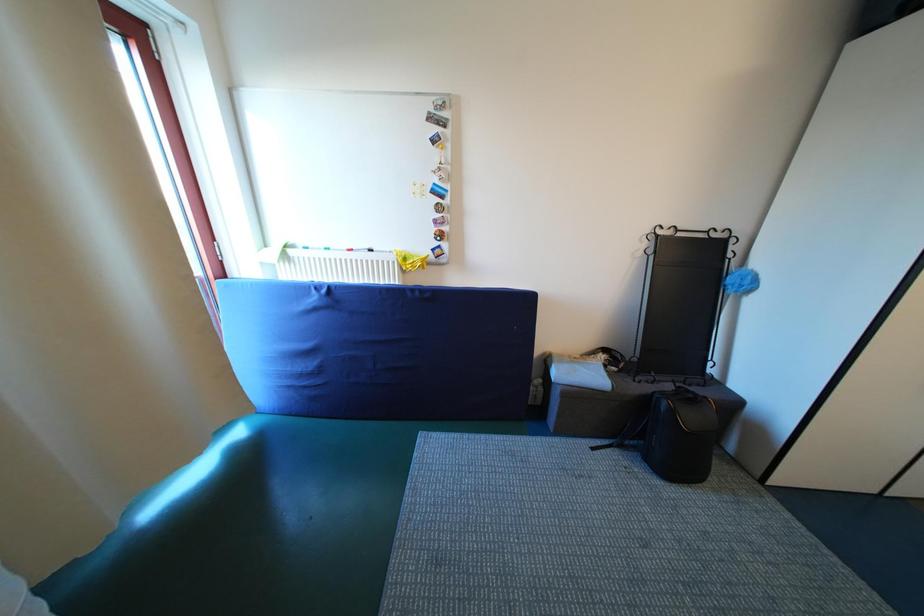
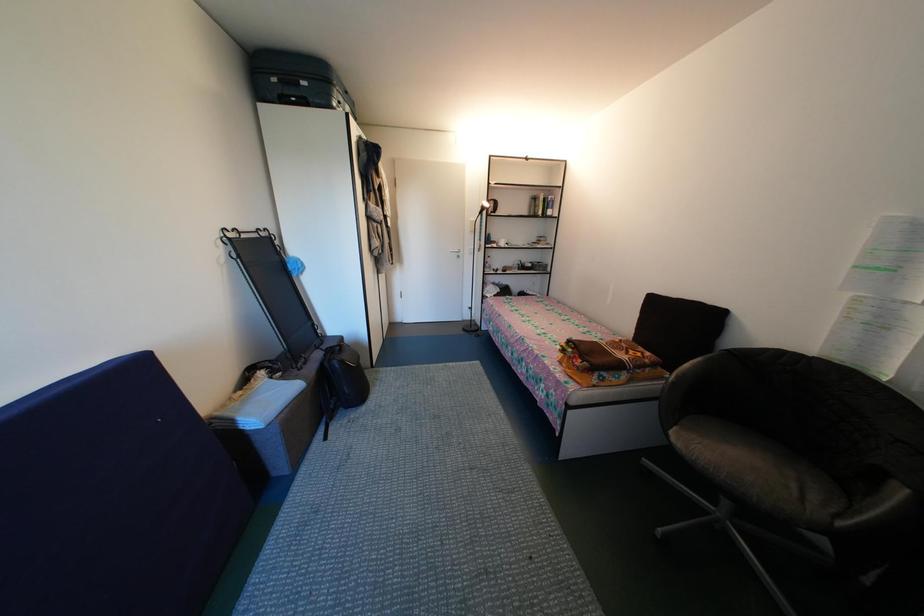
How did the camera likely rotate?

The camera's rotation is toward right-down.